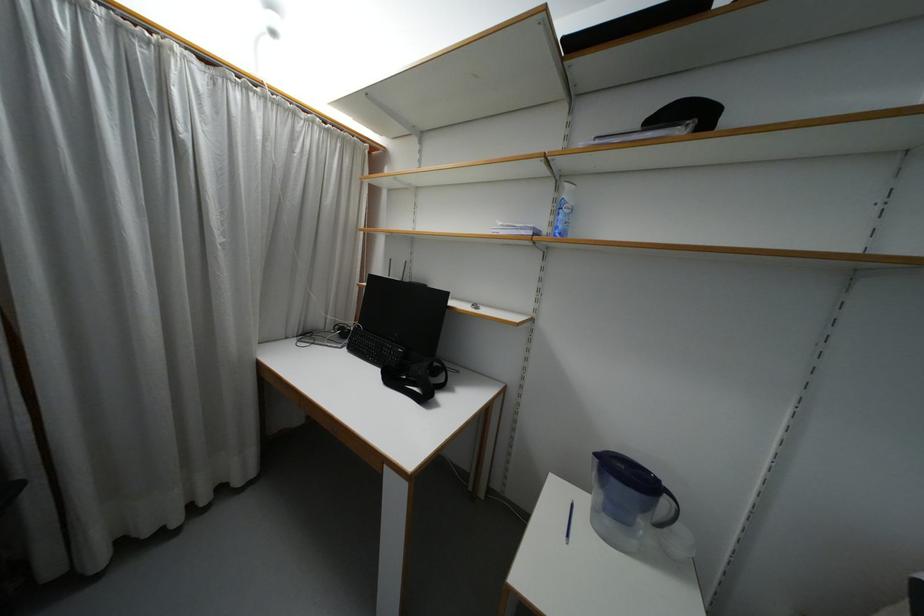
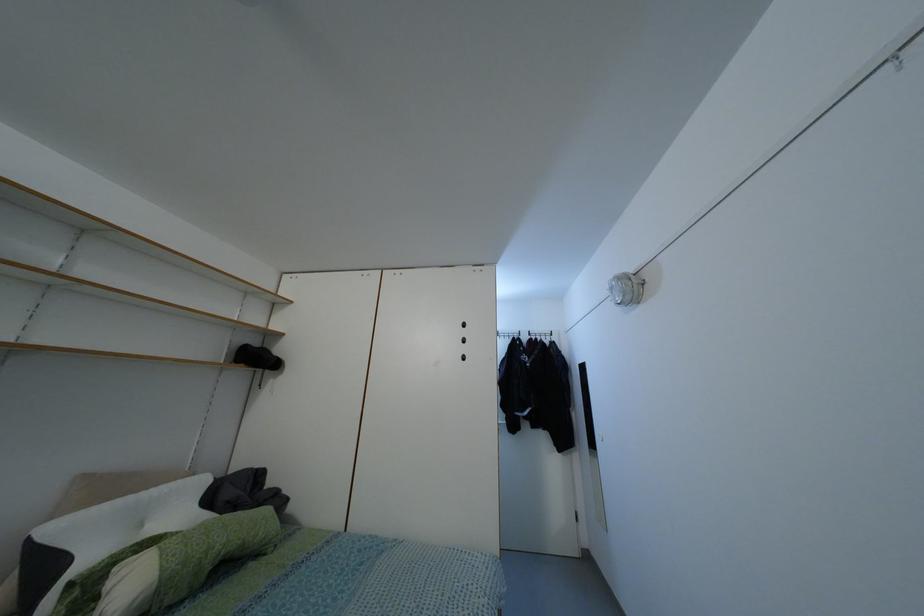
Question: Based on the continuous images, in which direction is the camera rotating? Reply with the corresponding letter.

Choices:
 (A) Left
 (B) Right
 (C) Up
 (D) Down

Answer: (B)